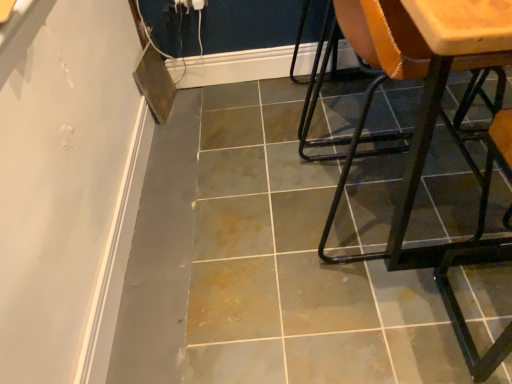
Question: Is gray tile floor at center a part of metallic orange chair at right, which ranks as the 2th chair in left-to-right order?

Choices:
 (A) no
 (B) yes

Answer: (A)

Question: Would you say metallic orange chair at right, which ranks as the 2th chair in left-to-right order, is outside gray tile floor at center?

Choices:
 (A) no
 (B) yes

Answer: (B)

Question: Considering the relative positions of metallic orange chair at right, which ranks as the 2th chair in left-to-right order, and gray tile floor at center in the image provided, is metallic orange chair at right, which ranks as the 2th chair in left-to-right order, to the left of gray tile floor at center from the viewer's perspective?

Choices:
 (A) yes
 (B) no

Answer: (B)

Question: Is metallic orange chair at right, which ranks as the 2th chair in right-to-left order, taller than gray tile floor at center?

Choices:
 (A) no
 (B) yes

Answer: (B)

Question: Does metallic orange chair at right, which ranks as the 2th chair in left-to-right order, have a lesser height compared to gray tile floor at center?

Choices:
 (A) yes
 (B) no

Answer: (B)

Question: Is gray tile floor at center at the back of metallic orange chair at right, which ranks as the 2th chair in right-to-left order?

Choices:
 (A) no
 (B) yes

Answer: (A)

Question: Considering the relative sizes of matte orange chair at right, positioned as the third chair in right-to-left order, and metallic orange chair at right, which ranks as the 2th chair in left-to-right order, in the image provided, is matte orange chair at right, positioned as the third chair in right-to-left order, bigger than metallic orange chair at right, which ranks as the 2th chair in left-to-right order,?

Choices:
 (A) yes
 (B) no

Answer: (A)

Question: Is matte orange chair at right, positioned as the third chair in right-to-left order, behind metallic orange chair at right, which ranks as the 2th chair in right-to-left order?

Choices:
 (A) yes
 (B) no

Answer: (A)

Question: From a real-world perspective, is matte orange chair at right, positioned as the third chair in right-to-left order, over metallic orange chair at right, which ranks as the 2th chair in left-to-right order?

Choices:
 (A) no
 (B) yes

Answer: (A)

Question: Is matte orange chair at right, positioned as the third chair in right-to-left order, thinner than metallic orange chair at right, which ranks as the 2th chair in right-to-left order?

Choices:
 (A) no
 (B) yes

Answer: (A)

Question: Is matte orange chair at right, positioned as the third chair in right-to-left order, positioned beyond the bounds of metallic orange chair at right, which ranks as the 2th chair in right-to-left order?

Choices:
 (A) yes
 (B) no

Answer: (A)

Question: Does matte orange chair at right, the first chair in the left-to-right sequence, turn towards metallic orange chair at right, which ranks as the 2th chair in right-to-left order?

Choices:
 (A) yes
 (B) no

Answer: (B)

Question: Is gray tile floor at center behind metallic orange chair at right, which ranks as the 2th chair in right-to-left order?

Choices:
 (A) yes
 (B) no

Answer: (A)